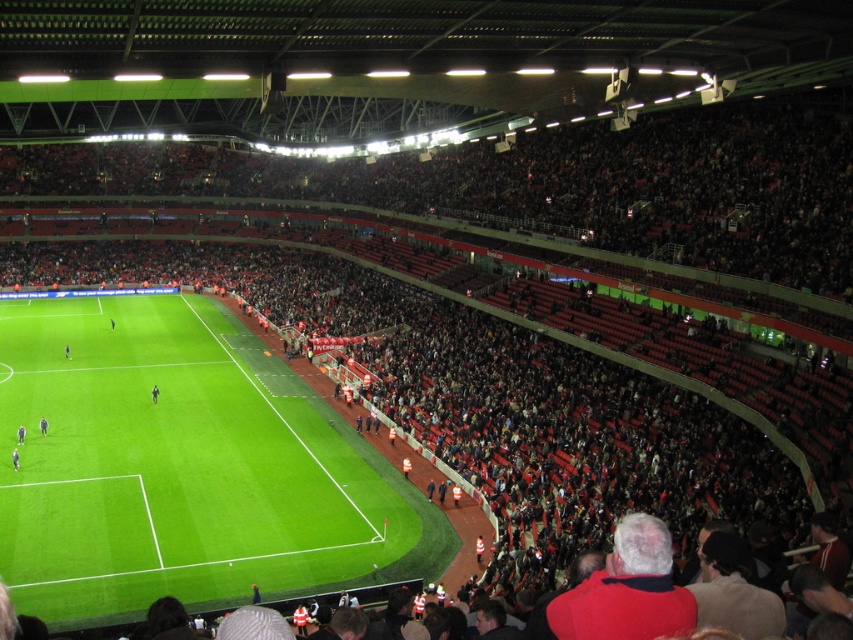
Question: Among these points, which one is farthest from the camera?

Choices:
 (A) (41, 426)
 (B) (16, 451)
 (C) (154, 392)
 (D) (22, 436)

Answer: (C)

Question: Is dark gray fabric jacket at lower left above dark gray uniform at center?

Choices:
 (A) yes
 (B) no

Answer: (B)

Question: Which object appears closest to the camera in this image?

Choices:
 (A) dark gray uniform at center
 (B) dark gray fabric jacket at lower left
 (C) green artificial turf at center

Answer: (C)

Question: Is light blue jersey at center in front of dark blue jersey at center?

Choices:
 (A) yes
 (B) no

Answer: (A)

Question: Is the position of light blue jersey at center more distant than that of dark gray uniform at center?

Choices:
 (A) yes
 (B) no

Answer: (B)

Question: Which object is the farthest from the dark blue jersey at center?

Choices:
 (A) green artificial turf at center
 (B) light blue jersey at center
 (C) dark gray uniform at center
 (D) dark gray fabric jacket at lower left

Answer: (A)